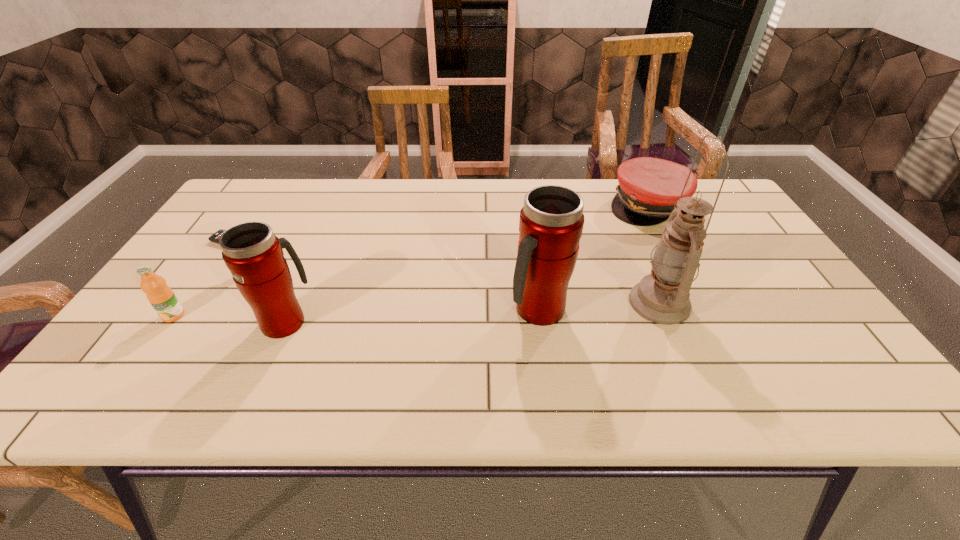
Where is `object that is at the right edge`? Image resolution: width=960 pixels, height=540 pixels. object that is at the right edge is located at coordinates (649, 188).

Identify the location of object present at the far right corner. This screenshot has width=960, height=540. (649, 188).

This screenshot has height=540, width=960. Find the location of `vacant space at the far edge`. vacant space at the far edge is located at coordinates (331, 178).

At what (x,y) coordinates should I click in order to perform the action: click on free point at the near edge. Please return your answer as a coordinate pair (x, y). This screenshot has height=540, width=960. Looking at the image, I should click on (726, 333).

You are a GUI agent. You are given a task and a screenshot of the screen. Output one action in this format:
    pyautogui.click(x=<x>, y=<y>)
    Task: Click on the free space at the left edge of the desktop
    
    Given the screenshot: What is the action you would take?
    pos(156,312)

You are a GUI agent. You are given a task and a screenshot of the screen. Output one action in this format:
    pyautogui.click(x=<x>, y=<y>)
    Task: Click on the blank area at the right edge
    
    Given the screenshot: What is the action you would take?
    pyautogui.click(x=772, y=259)

This screenshot has width=960, height=540. What are the coordinates of `vacant region at the far left corner` in the screenshot? It's located at (246, 196).

Find the location of a particular element. free space that is in between the tallest object and the shorter thermos bottle is located at coordinates (472, 312).

Find the location of a particular element. The width and height of the screenshot is (960, 540). free spot between the remote control and the fourth object from left to right is located at coordinates (391, 278).

I want to click on free point between the remote control and the tallest object, so click(x=451, y=274).